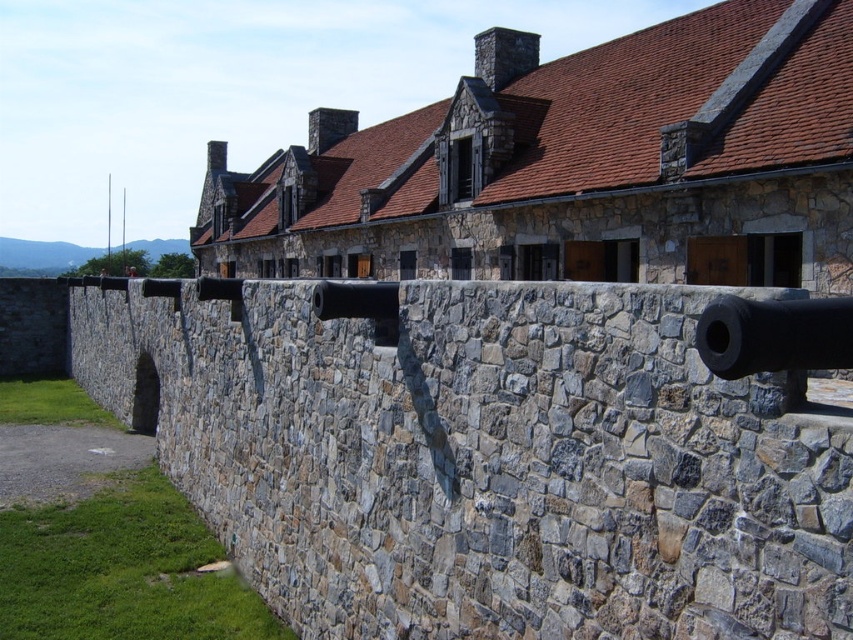
Question: Which is farther from the gray stone wall at center?

Choices:
 (A) black matte cannon at right
 (B) stone brick building at center

Answer: (B)

Question: Is stone brick building at center to the left of black matte cannon at right from the viewer's perspective?

Choices:
 (A) yes
 (B) no

Answer: (A)

Question: Can you confirm if stone brick building at center is thinner than black matte cannon at right?

Choices:
 (A) yes
 (B) no

Answer: (B)

Question: Which object is the farthest from the stone brick building at center?

Choices:
 (A) gray stone wall at center
 (B) black matte cannon at right

Answer: (B)

Question: Which object is closer to the camera taking this photo?

Choices:
 (A) black matte cannon at right
 (B) gray stone wall at center

Answer: (A)

Question: Does gray stone wall at center come behind stone brick building at center?

Choices:
 (A) no
 (B) yes

Answer: (A)